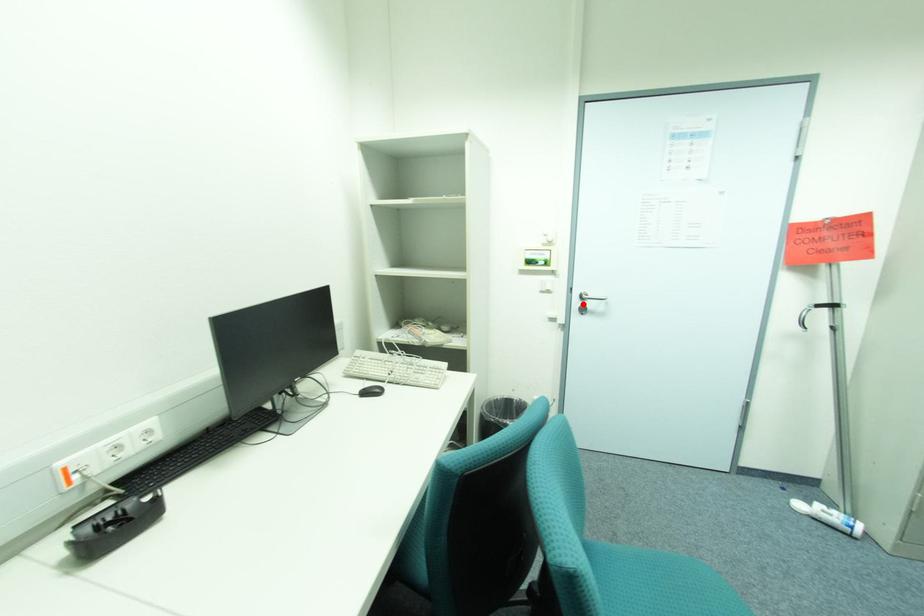
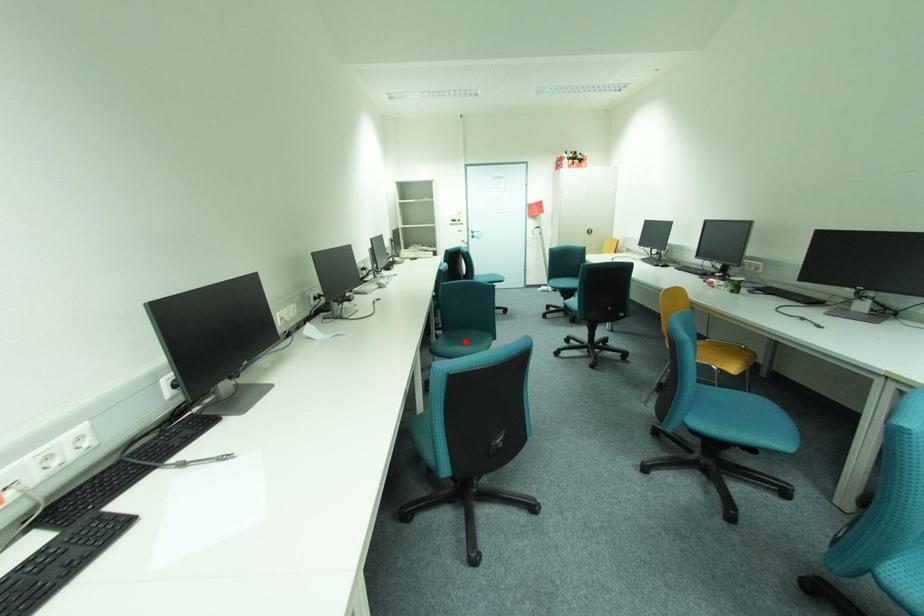
I am providing you with two images of the same scene from different viewpoints. A red point is marked on the first image and another point is marked on the second image. Does the point marked in image1 correspond to the same location as the one in image2?

No